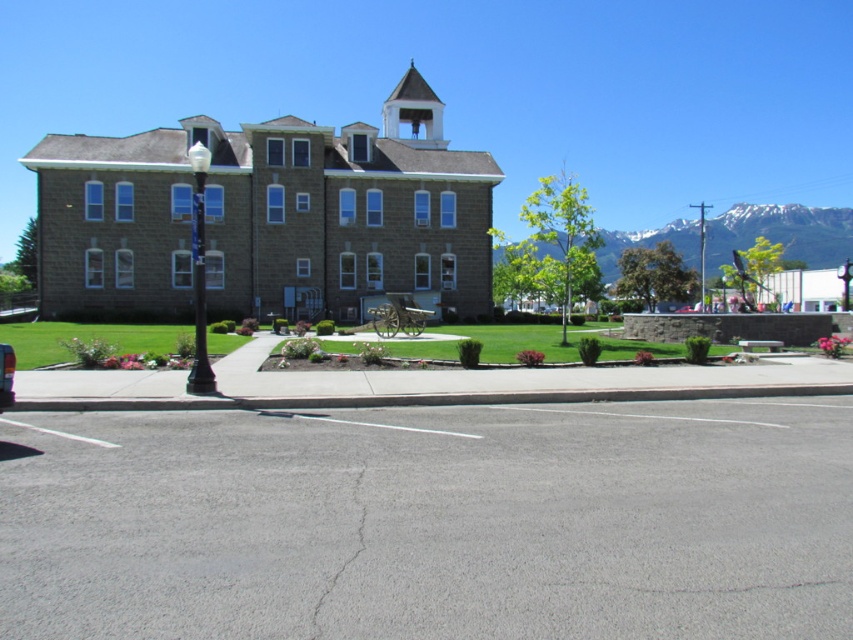
Does gray stone church at center have a smaller size compared to metallic silver car at lower left?

No.

Can you confirm if gray stone church at center is positioned to the right of metallic silver car at lower left?

Incorrect, gray stone church at center is not on the right side of metallic silver car at lower left.

Is point (254, 230) positioned in front of point (4, 360)?

No.

Identify the location of gray stone church at center. (260, 221).

Does snowy granite mountain at upper right lie in front of white stucco bell tower at upper center?

No, snowy granite mountain at upper right is further to the viewer.

Is snowy granite mountain at upper right below white stucco bell tower at upper center?

Indeed, snowy granite mountain at upper right is positioned under white stucco bell tower at upper center.

In order to click on snowy granite mountain at upper right in this screenshot , I will do `click(781, 232)`.

Between point (674, 449) and point (393, 253), which one is positioned in front?

Point (674, 449) is in front.

Is gray asphalt at lower center thinner than gray stone church at center?

Yes.

The image size is (853, 640). In order to click on gray asphalt at lower center in this screenshot , I will do `click(431, 522)`.

In order to click on gray asphalt at lower center in this screenshot , I will do `click(431, 522)`.